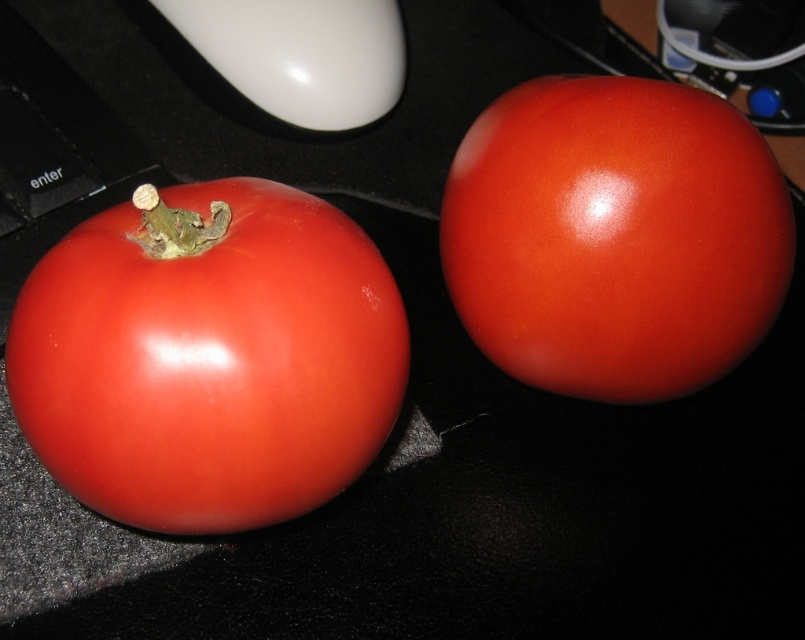
Question: Where is glossy red tomato at center located in relation to white glossy mouse at upper center in the image?

Choices:
 (A) right
 (B) left

Answer: (A)

Question: Does glossy red tomato at left have a lesser width compared to glossy red tomato at center?

Choices:
 (A) yes
 (B) no

Answer: (B)

Question: Can you confirm if glossy red tomato at center is thinner than white glossy mouse at upper center?

Choices:
 (A) no
 (B) yes

Answer: (A)

Question: Based on their relative distances, which object is nearer to the glossy red tomato at center?

Choices:
 (A) white glossy mouse at upper center
 (B) glossy red tomato at left

Answer: (B)

Question: Estimate the real-world distances between objects in this image. Which object is closer to the white glossy mouse at upper center?

Choices:
 (A) glossy red tomato at left
 (B) glossy red tomato at center

Answer: (B)

Question: Which of the following is the farthest from the observer?

Choices:
 (A) (345, 112)
 (B) (592, 330)

Answer: (A)